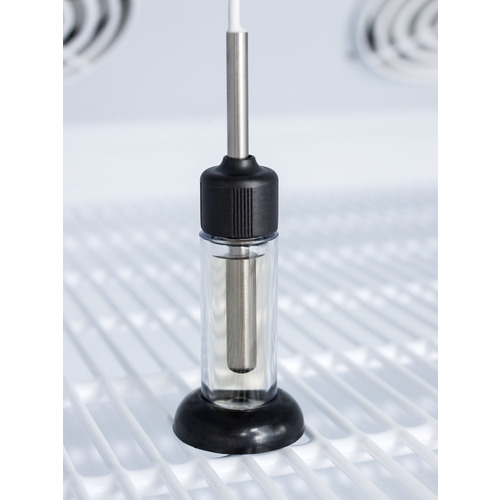
The width and height of the screenshot is (500, 500). I want to click on stove, so click(x=83, y=19).